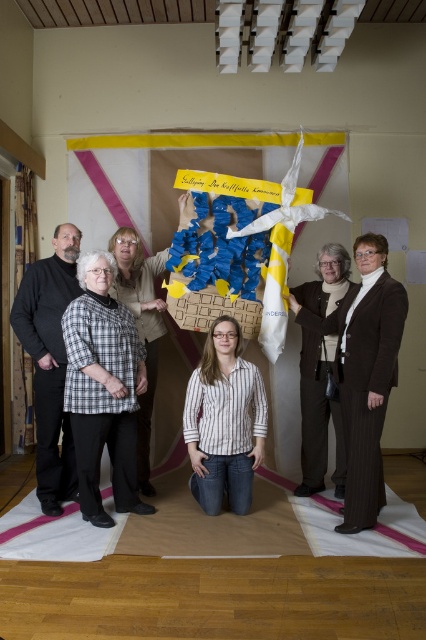
Question: Among these points, which one is farthest from the camera?

Choices:
 (A) (305, 451)
 (B) (227, 451)

Answer: (A)

Question: Does brown woolen sweater at center appear under striped shirt at center?

Choices:
 (A) no
 (B) yes

Answer: (B)

Question: Is brown woolen sweater at center above striped shirt at center?

Choices:
 (A) yes
 (B) no

Answer: (B)

Question: Is striped cotton shirt at center bigger than black matte shirt at left?

Choices:
 (A) yes
 (B) no

Answer: (B)

Question: Among these objects, which one is nearest to the camera?

Choices:
 (A) black matte shirt at left
 (B) striped shirt at center
 (C) brown woolen sweater at center
 (D) brown pinstripe suit at right

Answer: (D)

Question: Which point is closer to the camera taking this photo?

Choices:
 (A) (45, 413)
 (B) (138, 470)

Answer: (A)